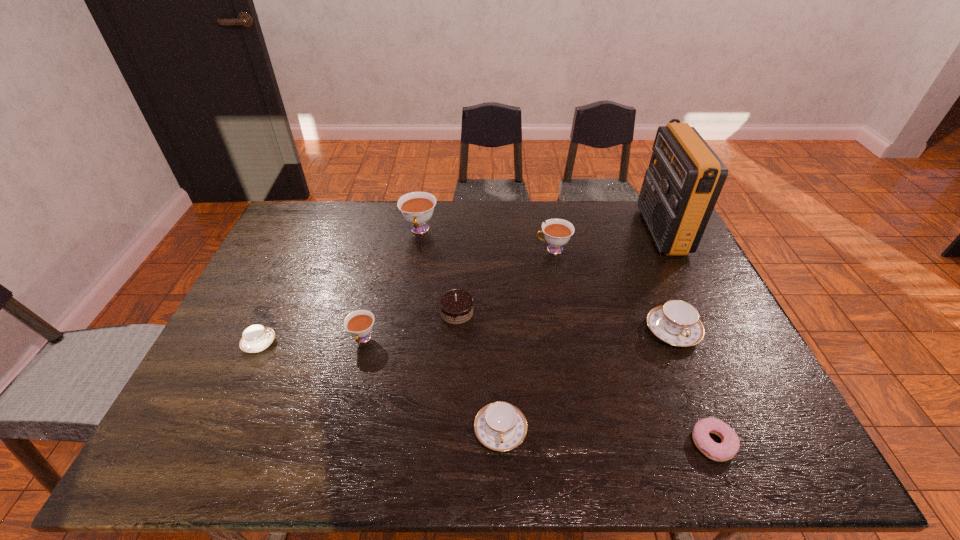
Where is `the nearest teacup`? This screenshot has width=960, height=540. the nearest teacup is located at coordinates coord(500,426).

I want to click on the fourth teacup from left to right, so click(500, 426).

At what (x,y) coordinates should I click in order to perform the action: click on the smallest blue teacup. Please return your answer as a coordinate pair (x, y). The width and height of the screenshot is (960, 540). Looking at the image, I should click on (255, 338).

This screenshot has height=540, width=960. I want to click on the leftmost teacup, so click(255, 338).

Locate an element on the screen. pink doughnut is located at coordinates (730, 443).

Locate an element on the screen. The width and height of the screenshot is (960, 540). the shortest object is located at coordinates (730, 443).

Image resolution: width=960 pixels, height=540 pixels. Identify the location of free space located 0.170m on the front-facing side of the radio receiver. (597, 231).

You are a GUI agent. You are given a task and a screenshot of the screen. Output one action in this format:
    pyautogui.click(x=<x>, y=<y>)
    Task: Click on the vacant space located 0.220m on the front-facing side of the radio receiver
    
    Given the screenshot: What is the action you would take?
    pyautogui.click(x=583, y=231)

The width and height of the screenshot is (960, 540). Identify the location of free space located on the front-facing side of the radio receiver. (560, 231).

Where is `vacant region located on the side of the eighth shortest object with the handle`? The width and height of the screenshot is (960, 540). vacant region located on the side of the eighth shortest object with the handle is located at coordinates (414, 269).